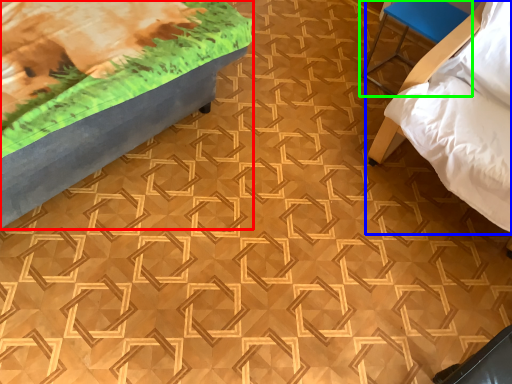
Question: Estimate the real-world distances between objects in this image. Which object is farther from furniture (highlighted by a red box), furniture (highlighted by a blue box) or furniture (highlighted by a green box)?

Choices:
 (A) furniture
 (B) furniture

Answer: (B)